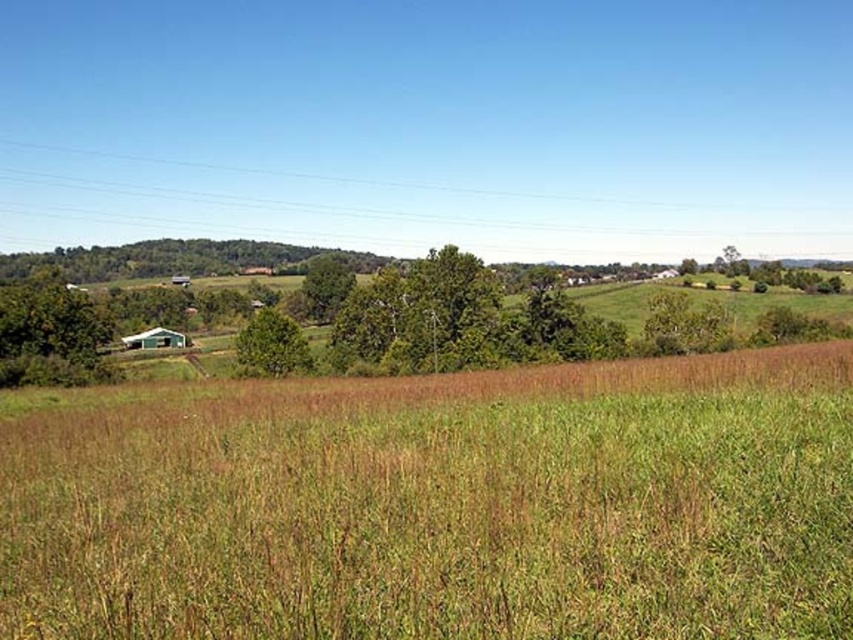
Question: Which object is farther from the camera taking this photo?

Choices:
 (A) green leafy tree at center
 (B) brown wooden power line at upper center
 (C) green matte tree at left

Answer: (B)

Question: From the image, what is the correct spatial relationship of brown wooden power line at upper center in relation to green matte tree at left?

Choices:
 (A) above
 (B) below

Answer: (A)

Question: Does brown wooden power line at upper center have a lesser width compared to green leafy tree at center?

Choices:
 (A) no
 (B) yes

Answer: (A)

Question: Estimate the real-world distances between objects in this image. Which object is closer to the green leafy tree at center?

Choices:
 (A) brown wooden power line at upper center
 (B) green matte tree at left

Answer: (B)

Question: Can you confirm if brown wooden power line at upper center is smaller than green leafy tree at center?

Choices:
 (A) no
 (B) yes

Answer: (A)

Question: Which point is farther to the camera?

Choices:
 (A) green leafy tree at center
 (B) brown wooden power line at upper center
 (C) green matte tree at left

Answer: (B)